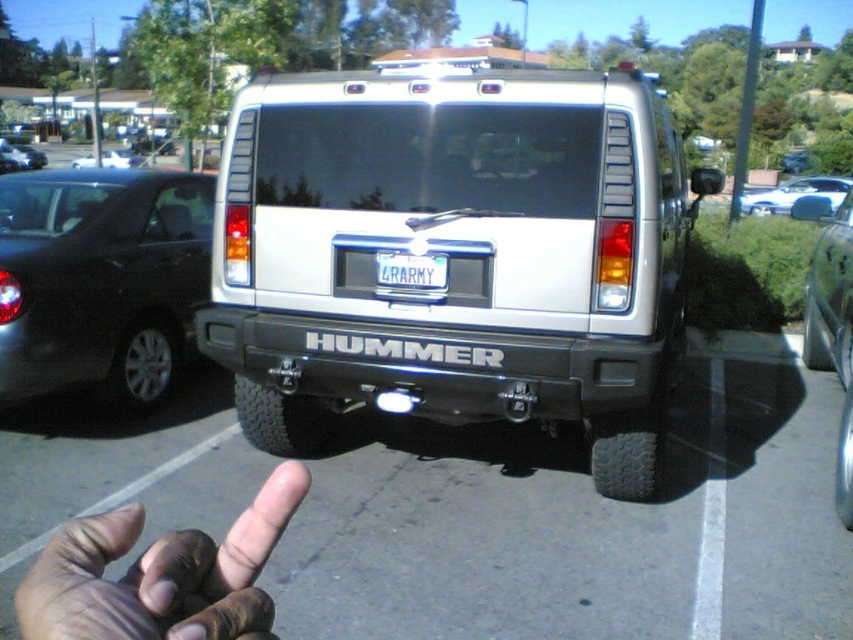
Is shiny black sedan at left to the left of white glossy sedan at upper right from the viewer's perspective?

Yes, shiny black sedan at left is to the left of white glossy sedan at upper right.

Can you confirm if shiny black sedan at left is bigger than white glossy sedan at upper right?

Actually, shiny black sedan at left might be smaller than white glossy sedan at upper right.

Consider the image. Who is more distant from viewer, (24, 280) or (775, 195)?

Point (775, 195)

Where is `shiny black sedan at left`? The width and height of the screenshot is (853, 640). shiny black sedan at left is located at coordinates (100, 280).

Does silver metallic hummer at center have a smaller size compared to white matte sedan at upper left?

Actually, silver metallic hummer at center might be larger than white matte sedan at upper left.

Is silver metallic hummer at center taller than white matte sedan at upper left?

Yes.

Between point (654, 252) and point (114, 154), which one is positioned behind?

Positioned behind is point (114, 154).

Find the location of `silver metallic hummer at center`. silver metallic hummer at center is located at coordinates (453, 253).

Measure the distance between silver metallic car at right and camera.

silver metallic car at right and camera are 6.93 meters apart.

Does silver metallic car at right have a lesser height compared to white matte sedan at upper left?

Correct, silver metallic car at right is not as tall as white matte sedan at upper left.

At what (x,y) coordinates should I click in order to perform the action: click on silver metallic car at right. Please return your answer as a coordinate pair (x, y). The width and height of the screenshot is (853, 640). Looking at the image, I should click on (831, 321).